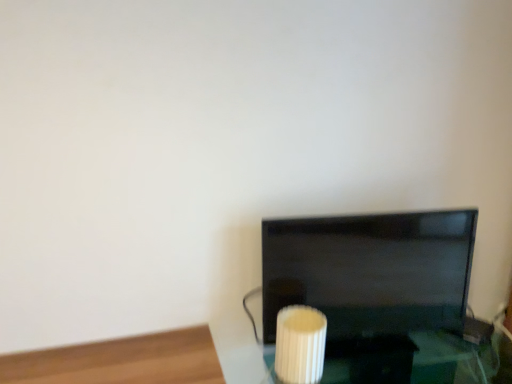
Question: Is point (367, 286) positioned closer to the camera than point (306, 350)?

Choices:
 (A) closer
 (B) farther

Answer: (B)

Question: Choose the correct answer: Is black glossy tv at center inside white ribbed glass at lower center or outside it?

Choices:
 (A) outside
 (B) inside

Answer: (A)

Question: Based on their positions, is black glossy tv at center located to the left or right of white ribbed glass at lower center?

Choices:
 (A) right
 (B) left

Answer: (A)

Question: Is point (320, 317) closer or farther from the camera than point (304, 241)?

Choices:
 (A) closer
 (B) farther

Answer: (A)

Question: From the image's perspective, is white ribbed glass at lower center positioned above or below black glossy tv at center?

Choices:
 (A) below
 (B) above

Answer: (A)

Question: Choose the correct answer: Is white ribbed glass at lower center inside black glossy tv at center or outside it?

Choices:
 (A) inside
 (B) outside

Answer: (B)

Question: Looking at their shapes, would you say white ribbed glass at lower center is wider or thinner than black glossy tv at center?

Choices:
 (A) thin
 (B) wide

Answer: (B)